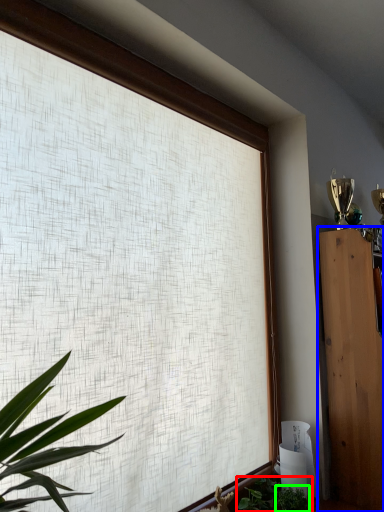
Question: Which is farther away from houseplant (highlighted by a red box)? furniture (highlighted by a blue box) or plant (highlighted by a green box)?

Choices:
 (A) furniture
 (B) plant

Answer: (A)